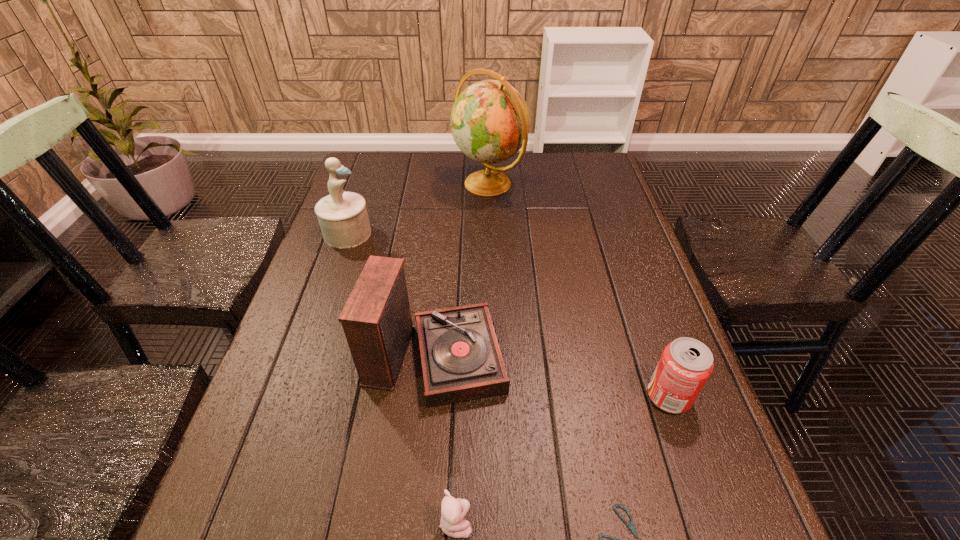
This screenshot has width=960, height=540. Find the location of `object that stands as the second closest to the rightmost object`. object that stands as the second closest to the rightmost object is located at coordinates (461, 360).

Find the location of a particular element. free point that satisfies the following two spatial constraints: 1. at the beak of the figurine; 2. on the left side of the rightmost object is located at coordinates (291, 396).

I want to click on free space that satisfies the following two spatial constraints: 1. on the back side of the phonograph record; 2. at the beak of the leftmost object, so click(447, 233).

You are a GUI agent. You are given a task and a screenshot of the screen. Output one action in this format:
    pyautogui.click(x=<x>, y=<y>)
    Task: Click on the vacant space that satisfies the following two spatial constraints: 1. on the front side of the third shortest object; 2. on the left side of the phonograph record
    This screenshot has width=960, height=540.
    Given the screenshot: What is the action you would take?
    pyautogui.click(x=434, y=396)

In order to click on free space that satisfies the following two spatial constraints: 1. at the beak of the leftmost object; 2. on the back side of the phonograph record in this screenshot , I will do `click(306, 353)`.